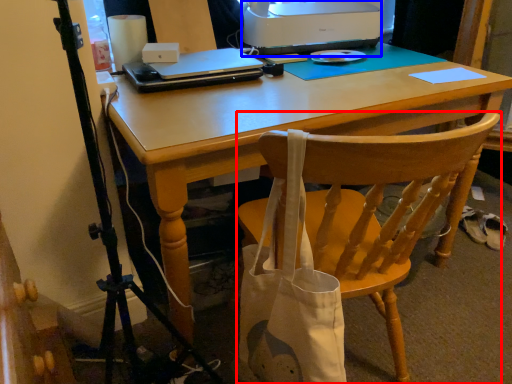
Question: Which object is closer to the camera taking this photo, chair (highlighted by a red box) or printer (highlighted by a blue box)?

Choices:
 (A) chair
 (B) printer

Answer: (A)